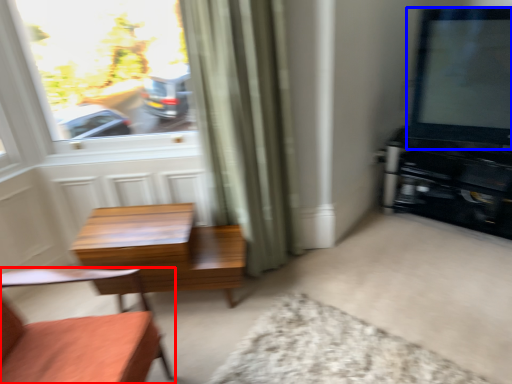
Question: Among these objects, which one is farthest to the camera, chair (highlighted by a red box) or window screen (highlighted by a blue box)?

Choices:
 (A) chair
 (B) window screen

Answer: (B)